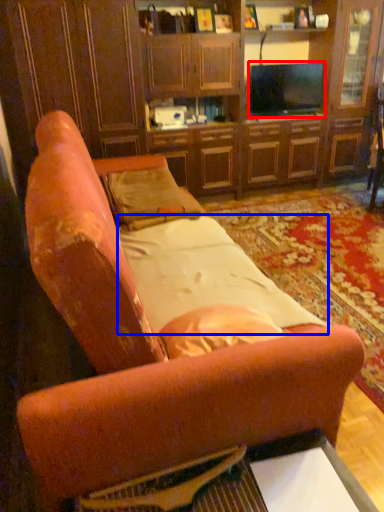
Question: Which point is closer to the camera, television (highlighted by a red box) or sheet (highlighted by a blue box)?

Choices:
 (A) television
 (B) sheet

Answer: (B)